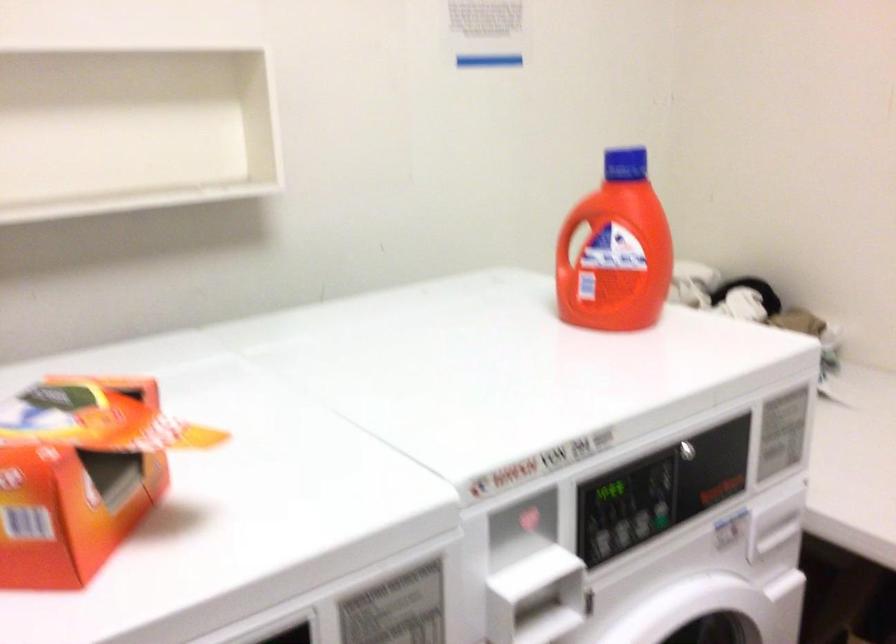
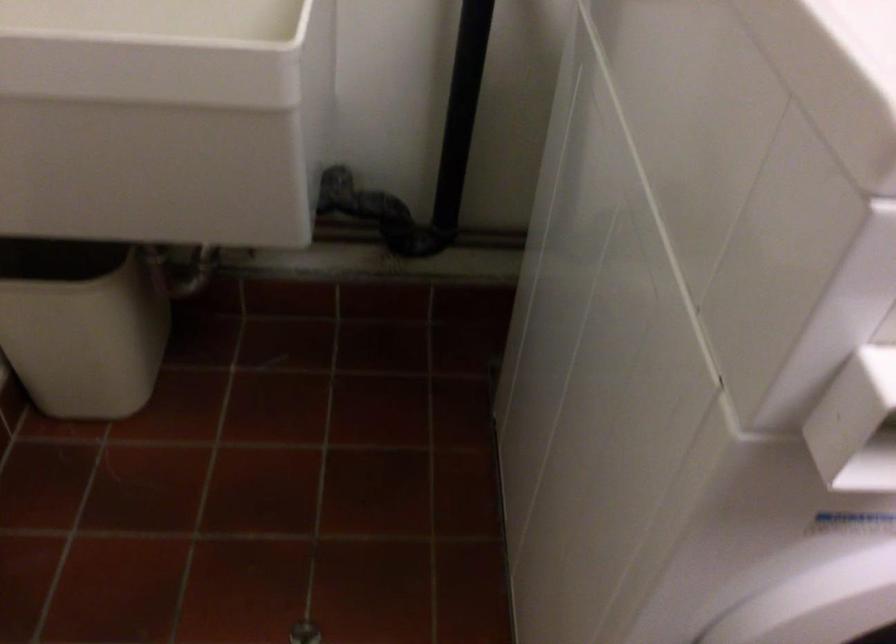
The first image is from the beginning of the video and the second image is from the end. How did the camera likely rotate when shooting the video?

The camera's rotation is toward left-down.